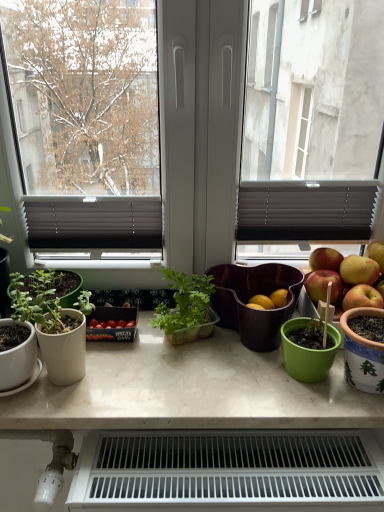
Question: Can translucent plastic plant container at center, the first houseplant when ordered from right to left, be found inside matte white pot at left, which is the 2th houseplant from right to left?

Choices:
 (A) yes
 (B) no

Answer: (B)

Question: Does matte white pot at left, which is the 2th houseplant from right to left, appear on the right side of translucent plastic plant container at center, which is the 2th houseplant in left-to-right order?

Choices:
 (A) no
 (B) yes

Answer: (A)

Question: Is matte white pot at left, which is the 2th houseplant from right to left, taller than translucent plastic plant container at center, which is the 2th houseplant in left-to-right order?

Choices:
 (A) no
 (B) yes

Answer: (B)

Question: Can we say matte white pot at left, which is the 2th houseplant from right to left, lies outside translucent plastic plant container at center, the first houseplant when ordered from right to left?

Choices:
 (A) yes
 (B) no

Answer: (A)

Question: Is matte white pot at left, which is the 2th houseplant from right to left, bigger than translucent plastic plant container at center, the first houseplant when ordered from right to left?

Choices:
 (A) yes
 (B) no

Answer: (B)

Question: Are matte white pot at left, which is the 2th houseplant from right to left, and translucent plastic plant container at center, the first houseplant when ordered from right to left, located far from each other?

Choices:
 (A) yes
 (B) no

Answer: (B)

Question: Does white marble table at center come in front of christmas-patterned ceramic pot at right?

Choices:
 (A) no
 (B) yes

Answer: (A)

Question: Considering the relative sizes of white marble table at center and christmas-patterned ceramic pot at right in the image provided, is white marble table at center smaller than christmas-patterned ceramic pot at right?

Choices:
 (A) no
 (B) yes

Answer: (A)

Question: Can you confirm if white marble table at center is positioned to the right of christmas-patterned ceramic pot at right?

Choices:
 (A) yes
 (B) no

Answer: (B)

Question: Does white marble table at center come behind christmas-patterned ceramic pot at right?

Choices:
 (A) yes
 (B) no

Answer: (A)

Question: Is white marble table at center to the left of christmas-patterned ceramic pot at right from the viewer's perspective?

Choices:
 (A) no
 (B) yes

Answer: (B)

Question: Considering the relative sizes of white marble table at center and christmas-patterned ceramic pot at right in the image provided, is white marble table at center bigger than christmas-patterned ceramic pot at right?

Choices:
 (A) yes
 (B) no

Answer: (A)

Question: From the image's perspective, is white plastic radiator at lower center under translucent plastic plant container at center, which is the 2th houseplant in left-to-right order?

Choices:
 (A) no
 (B) yes

Answer: (B)